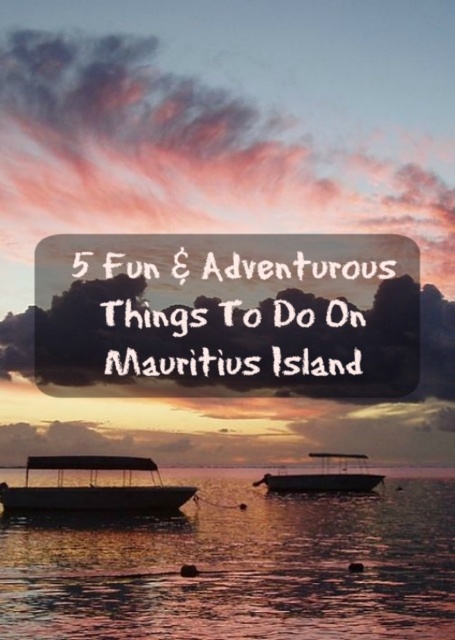
Question: Which of the following is the farthest from the observer?

Choices:
 (A) matte black boat at center
 (B) translucent water at center

Answer: (A)

Question: Which point is farther from the camera taking this photo?

Choices:
 (A) (111, 468)
 (B) (319, 458)
 (C) (439, 566)

Answer: (B)

Question: Where is matte black boat at lower left located in relation to matte black boat at center in the image?

Choices:
 (A) below
 (B) above

Answer: (B)

Question: Among these points, which one is nearest to the camera?

Choices:
 (A) (444, 552)
 (B) (95, 481)
 (C) (313, 484)

Answer: (A)

Question: Can you confirm if matte black boat at lower left is positioned to the right of matte black boat at center?

Choices:
 (A) no
 (B) yes

Answer: (A)

Question: Observing the image, what is the correct spatial positioning of translucent water at center in reference to matte black boat at center?

Choices:
 (A) right
 (B) left

Answer: (B)